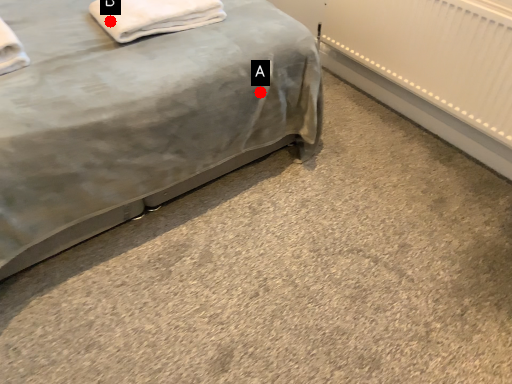
Question: Two points are circled on the image, labeled by A and B beside each circle. Which point is closer to the camera?

Choices:
 (A) A is closer
 (B) B is closer

Answer: (B)